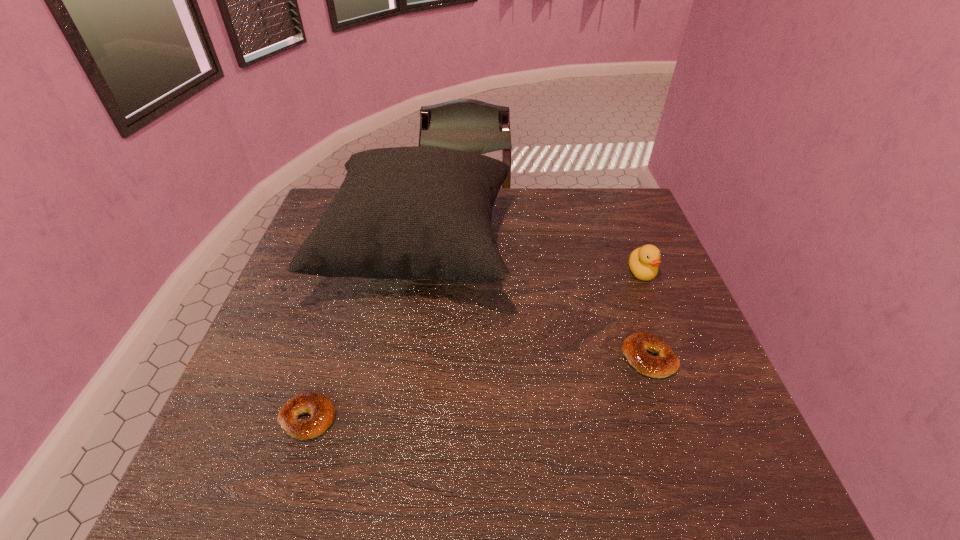
Identify the location of vacant region at the far right corner of the desktop. Image resolution: width=960 pixels, height=540 pixels. (610, 201).

Identify the location of free spot between the tallest object and the nearer bagel. The height and width of the screenshot is (540, 960). (364, 335).

The image size is (960, 540). In order to click on empty space that is in between the nearest object and the third shortest object in this screenshot , I will do `click(475, 345)`.

Locate an element on the screen. The height and width of the screenshot is (540, 960). free space between the tallest object and the right bagel is located at coordinates (535, 305).

Locate an element on the screen. free space between the third farthest object and the third shortest object is located at coordinates (645, 315).

The height and width of the screenshot is (540, 960). Find the location of `unoccupied position between the third shortest object and the farther bagel`. unoccupied position between the third shortest object and the farther bagel is located at coordinates (645, 315).

This screenshot has height=540, width=960. What are the coordinates of `unoccupied area between the tallest object and the left bagel` in the screenshot? It's located at (364, 335).

You are a GUI agent. You are given a task and a screenshot of the screen. Output one action in this format:
    pyautogui.click(x=<x>, y=<y>)
    Task: Click on the free point between the third farthest object and the nearest object
    
    Given the screenshot: What is the action you would take?
    tap(479, 388)

The image size is (960, 540). Find the location of `vacant area between the second nearest object and the nearer bagel`. vacant area between the second nearest object and the nearer bagel is located at coordinates (479, 388).

Find the location of a particular element. unoccupied area between the duck and the cushion is located at coordinates coord(531,262).